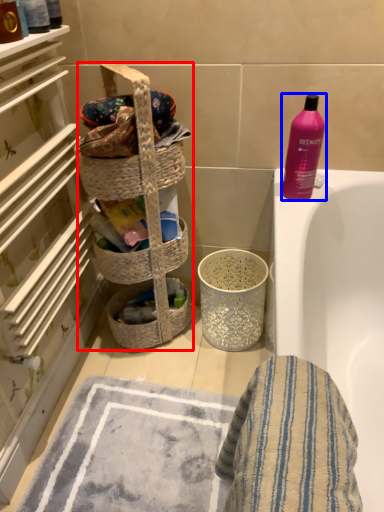
Question: Which point is closer to the camera, laundry basket (highlighted by a red box) or bottle (highlighted by a blue box)?

Choices:
 (A) laundry basket
 (B) bottle

Answer: (A)